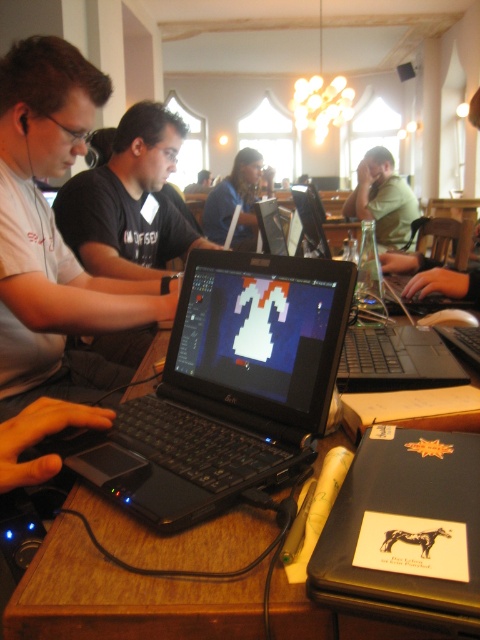
You are organizing a small event and need to place a decorative item on the table. The table has limited space. Given the current setup with the matte white shirt at left and the black glossy laptop at center, which object should you remove to free up more space?

The matte white shirt at left should be removed because it occupies less space than the black glossy laptop at center, so removing it would free up more space.

You are an office worker who needs to access the keyboard of the black glossy laptop at center. Can you reach it without moving the green matte shirt at center?

The green matte shirt at center is positioned over the black glossy laptop at center, so you cannot reach the keyboard without moving the shirt.